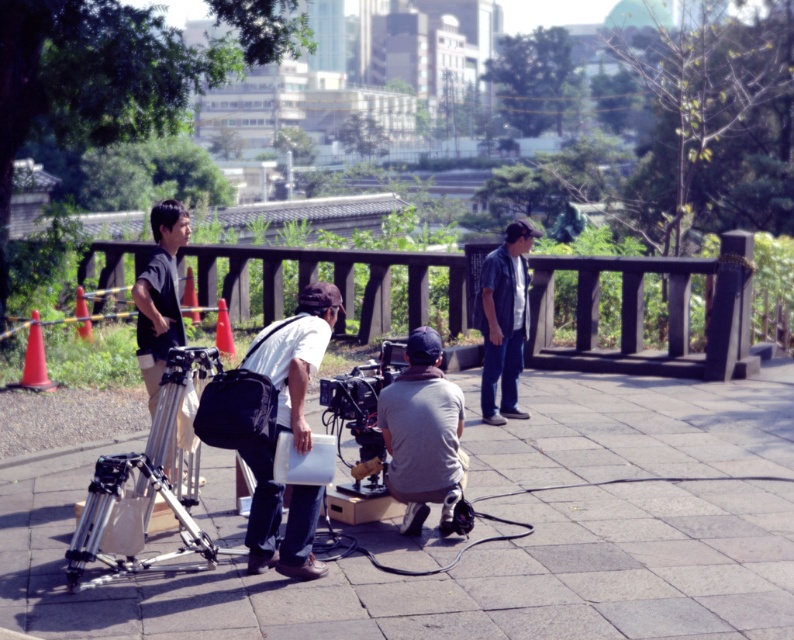
Can you confirm if brown wooden rail at center is positioned to the right of gray cotton shirt at center?

No, brown wooden rail at center is not to the right of gray cotton shirt at center.

Between brown wooden rail at center and gray cotton shirt at center, which one appears on the left side from the viewer's perspective?

Positioned to the left is brown wooden rail at center.

Who is more distant from viewer, (748, 257) or (399, 396)?

Positioned behind is point (748, 257).

Where is `brown wooden rail at center`? The width and height of the screenshot is (794, 640). brown wooden rail at center is located at coordinates (642, 314).

Does point (313, 324) come closer to viewer compared to point (368, 449)?

Yes, it is in front of point (368, 449).

Image resolution: width=794 pixels, height=640 pixels. Describe the element at coordinates (295, 355) in the screenshot. I see `white matte shirt at center` at that location.

Does point (272, 547) come farther from viewer compared to point (382, 378)?

That is False.

I want to click on white matte shirt at center, so click(295, 355).

Can you confirm if gray cotton shirt at center is bigger than dark gray fabric shirt at left?

Correct, gray cotton shirt at center is larger in size than dark gray fabric shirt at left.

Can you confirm if gray cotton shirt at center is taller than dark gray fabric shirt at left?

No.

You are a GUI agent. You are given a task and a screenshot of the screen. Output one action in this format:
    pyautogui.click(x=<x>, y=<y>)
    Task: Click on the gray cotton shirt at center
    The height and width of the screenshot is (640, 794).
    Given the screenshot: What is the action you would take?
    pyautogui.click(x=422, y=435)